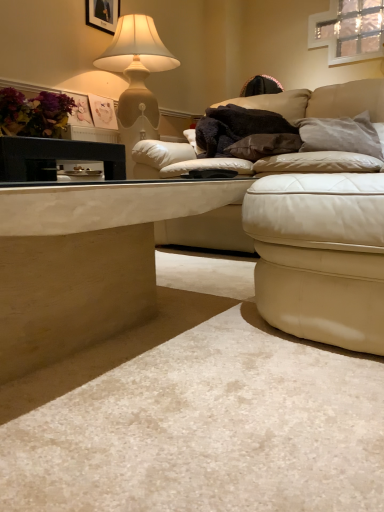
Image resolution: width=384 pixels, height=512 pixels. In order to click on clear glass window at upper right in this screenshot , I will do `click(357, 31)`.

What do you see at coordinates (264, 146) in the screenshot? The height and width of the screenshot is (512, 384). I see `brown suede pillow at center, the 1th pillow viewed from the left` at bounding box center [264, 146].

This screenshot has width=384, height=512. What do you see at coordinates (340, 135) in the screenshot? I see `gray suede pillow at upper right, which is the first pillow from right to left` at bounding box center [340, 135].

In order to click on clear glass window at upper right in this screenshot , I will do pyautogui.click(x=357, y=31).

From a real-world perspective, is leather ottoman at lower right located higher than leather couch at upper right?

No, from a real-world perspective, leather ottoman at lower right is not on top of leather couch at upper right.

Is point (340, 305) closer to camera compared to point (261, 250)?

Yes, it is in front of point (261, 250).

Locate an element on the screen. This screenshot has width=384, height=512. studio couch above the leather ottoman at lower right (from a real-world perspective) is located at coordinates (306, 246).

Does leather ottoman at lower right touch leather couch at upper right?

Yes, leather ottoman at lower right is in contact with leather couch at upper right.

Between smooth beige table at lower left, acting as the 1th table starting from the bottom, and black glossy table at left, which is the 1th table from top to bottom, which one appears on the left side from the viewer's perspective?

From the viewer's perspective, black glossy table at left, which is the 1th table from top to bottom, appears more on the left side.

Considering the sizes of smooth beige table at lower left, the 2th table positioned from the top, and black glossy table at left, the 2th table positioned from the bottom, in the image, is smooth beige table at lower left, the 2th table positioned from the top, bigger or smaller than black glossy table at left, the 2th table positioned from the bottom,?

In the image, smooth beige table at lower left, the 2th table positioned from the top, appears to be larger than black glossy table at left, the 2th table positioned from the bottom.

From a real-world perspective, is smooth beige table at lower left, acting as the 1th table starting from the bottom, on black glossy table at left, the 2th table positioned from the bottom?

Actually, smooth beige table at lower left, acting as the 1th table starting from the bottom, is physically below black glossy table at left, the 2th table positioned from the bottom, in the real world.

Is point (313, 132) closer or farther from the camera than point (285, 149)?

Point (313, 132) is farther from the camera than point (285, 149).

How many degrees apart are the facing directions of gray suede pillow at upper right, which is the first pillow from right to left, and brown suede pillow at center, the 1th pillow viewed from the left?

32.8 degrees separate the facing orientations of gray suede pillow at upper right, which is the first pillow from right to left, and brown suede pillow at center, the 1th pillow viewed from the left.

Is gray suede pillow at upper right, which is the first pillow from right to left, to the left of brown suede pillow at center, which is counted as the second pillow, starting from the right, from the viewer's perspective?

No, gray suede pillow at upper right, which is the first pillow from right to left, is not to the left of brown suede pillow at center, which is counted as the second pillow, starting from the right.

Considering the sizes of gray suede pillow at upper right, placed as the 2th pillow when sorted from left to right, and brown suede pillow at center, which is counted as the second pillow, starting from the right, in the image, is gray suede pillow at upper right, placed as the 2th pillow when sorted from left to right, wider or thinner than brown suede pillow at center, which is counted as the second pillow, starting from the right,?

In the image, gray suede pillow at upper right, placed as the 2th pillow when sorted from left to right, appears to be more narrow than brown suede pillow at center, which is counted as the second pillow, starting from the right.

Is black fuzzy blanket at center positioned far away from smooth beige table at lower left, the 2th table positioned from the top?

That's right, there is a large distance between black fuzzy blanket at center and smooth beige table at lower left, the 2th table positioned from the top.

Does black fuzzy blanket at center turn towards smooth beige table at lower left, the 2th table positioned from the top?

No, black fuzzy blanket at center is not turned towards smooth beige table at lower left, the 2th table positioned from the top.

From a real-world perspective, which table is the 2nd one underneath the black fuzzy blanket at center? Please provide its 2D coordinates.

[(85, 261)]

In terms of height, does black glossy table at left, the 2th table positioned from the bottom, look taller or shorter compared to leather ottoman at lower right?

black glossy table at left, the 2th table positioned from the bottom, is shorter than leather ottoman at lower right.

From a real-world perspective, is black glossy table at left, which is the 1th table from top to bottom, physically located above or below leather ottoman at lower right?

Clearly, from a real-world perspective, black glossy table at left, which is the 1th table from top to bottom, is above leather ottoman at lower right.

Is black glossy table at left, which is the 1th table from top to bottom, in front of or behind leather ottoman at lower right in the image?

Clearly, black glossy table at left, which is the 1th table from top to bottom, is behind leather ottoman at lower right.

Does point (255, 148) come farther from viewer compared to point (138, 287)?

That is True.

Does brown suede pillow at center, which is counted as the second pillow, starting from the right, contain smooth beige table at lower left, the 2th table positioned from the top?

Definitely not — smooth beige table at lower left, the 2th table positioned from the top, is not inside brown suede pillow at center, which is counted as the second pillow, starting from the right.

Based on the photo, is brown suede pillow at center, which is counted as the second pillow, starting from the right, in front of or behind smooth beige table at lower left, the 2th table positioned from the top, in the image?

Clearly, brown suede pillow at center, which is counted as the second pillow, starting from the right, is behind smooth beige table at lower left, the 2th table positioned from the top.

Which of these two, brown suede pillow at center, the 1th pillow viewed from the left, or smooth beige table at lower left, acting as the 1th table starting from the bottom, is smaller?

Smaller between the two is brown suede pillow at center, the 1th pillow viewed from the left.

Visually, is brown suede pillow at center, which is counted as the second pillow, starting from the right, positioned to the left or to the right of black glossy table at left, the 2th table positioned from the bottom?

brown suede pillow at center, which is counted as the second pillow, starting from the right, is to the right of black glossy table at left, the 2th table positioned from the bottom.

How many degrees apart are the facing directions of brown suede pillow at center, the 1th pillow viewed from the left, and black glossy table at left, the 2th table positioned from the bottom?

28.9 degrees.

From a real-world perspective, which object rests below the other?

black glossy table at left, the 2th table positioned from the bottom.

Considering the relative sizes of brown suede pillow at center, the 1th pillow viewed from the left, and black glossy table at left, the 2th table positioned from the bottom, in the image provided, is brown suede pillow at center, the 1th pillow viewed from the left, smaller than black glossy table at left, the 2th table positioned from the bottom,?

Incorrect, brown suede pillow at center, the 1th pillow viewed from the left, is not smaller in size than black glossy table at left, the 2th table positioned from the bottom.

Identify the location of studio couch located above the leather ottoman at lower right (from the image's perspective). (306, 246).

The image size is (384, 512). In order to click on table behind the smooth beige table at lower left, the 2th table positioned from the top in this screenshot , I will do `click(55, 157)`.

Which object lies nearer to the anchor point clear glass window at upper right, leather ottoman at lower right or leather couch at upper right?

Based on the image, leather couch at upper right appears to be nearer to clear glass window at upper right.

From the image, which object appears to be nearer to gray suede pillow at upper right, placed as the 2th pillow when sorted from left to right, smooth beige table at lower left, acting as the 1th table starting from the bottom, or brown suede pillow at center, which is counted as the second pillow, starting from the right?

The object closer to gray suede pillow at upper right, placed as the 2th pillow when sorted from left to right, is brown suede pillow at center, which is counted as the second pillow, starting from the right.

Estimate the real-world distances between objects in this image. Which object is closer to black matte picture frame at upper left, black fuzzy blanket at center or black glossy table at left, which is the 1th table from top to bottom?

Among the two, black fuzzy blanket at center is located nearer to black matte picture frame at upper left.

Looking at the image, which one is located closer to matte purple flowers at upper left, clear glass window at upper right or smooth beige table at lower left, acting as the 1th table starting from the bottom?

smooth beige table at lower left, acting as the 1th table starting from the bottom, lies closer to matte purple flowers at upper left than the other object.

Based on their spatial positions, is black fuzzy blanket at center or leather ottoman at lower right closer to brown suede pillow at center, the 1th pillow viewed from the left?

Based on the image, black fuzzy blanket at center appears to be nearer to brown suede pillow at center, the 1th pillow viewed from the left.

Based on their spatial positions, is smooth beige table at lower left, the 2th table positioned from the top, or black matte picture frame at upper left closer to leather couch at upper right?

smooth beige table at lower left, the 2th table positioned from the top, lies closer to leather couch at upper right than the other object.

Based on their spatial positions, is clear glass window at upper right or gray suede pillow at upper right, placed as the 2th pillow when sorted from left to right, further from leather ottoman at lower right?

clear glass window at upper right.

When comparing their distances from matte purple flowers at upper left, does matte beige lamp at upper left or gray suede pillow at upper right, which is the first pillow from right to left, seem further?

gray suede pillow at upper right, which is the first pillow from right to left, is further to matte purple flowers at upper left.

Image resolution: width=384 pixels, height=512 pixels. What are the coordinates of `picture frame between matte purple flowers at upper left and leather couch at upper right in the horizontal direction` in the screenshot? It's located at (103, 14).

Identify the location of lamp between black matte picture frame at upper left and matte purple flowers at upper left in the up-down direction. The height and width of the screenshot is (512, 384). (136, 78).

The width and height of the screenshot is (384, 512). I want to click on pillow between black fuzzy blanket at center and gray suede pillow at upper right, placed as the 2th pillow when sorted from left to right, in the horizontal direction, so click(x=264, y=146).

Locate an element on the screen. The width and height of the screenshot is (384, 512). studio couch between black glossy table at left, which is the 1th table from top to bottom, and brown suede pillow at center, which is counted as the second pillow, starting from the right, from front to back is located at coordinates (306, 246).